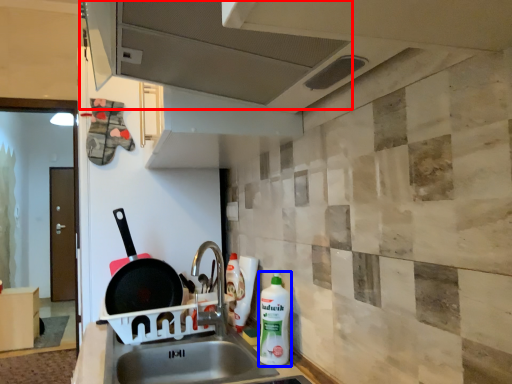
Question: Which object is closer to the camera taking this photo, exhaust hood (highlighted by a red box) or cleaning product (highlighted by a blue box)?

Choices:
 (A) exhaust hood
 (B) cleaning product

Answer: (A)